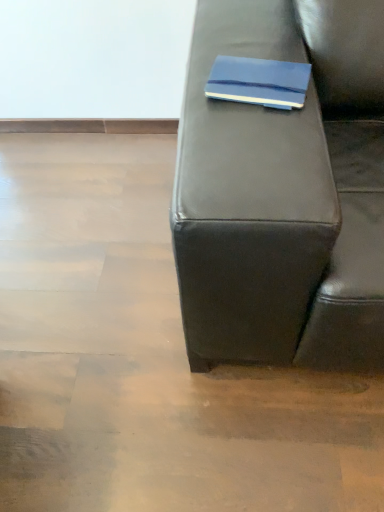
Question: Is blue matte notebook at upper center not near matte black couch at center?

Choices:
 (A) yes
 (B) no

Answer: (B)

Question: Considering the relative sizes of blue matte notebook at upper center and matte black couch at center in the image provided, is blue matte notebook at upper center bigger than matte black couch at center?

Choices:
 (A) no
 (B) yes

Answer: (A)

Question: Considering the relative positions of blue matte notebook at upper center and matte black couch at center in the image provided, is blue matte notebook at upper center behind matte black couch at center?

Choices:
 (A) yes
 (B) no

Answer: (A)

Question: Could you tell me if blue matte notebook at upper center is facing matte black couch at center?

Choices:
 (A) no
 (B) yes

Answer: (A)

Question: From the image's perspective, is blue matte notebook at upper center under matte black couch at center?

Choices:
 (A) yes
 (B) no

Answer: (B)

Question: Does blue matte notebook at upper center have a lesser width compared to matte black couch at center?

Choices:
 (A) yes
 (B) no

Answer: (A)

Question: Could you tell me if matte black couch at center is turned towards blue matte notebook at upper center?

Choices:
 (A) yes
 (B) no

Answer: (B)

Question: From the image's perspective, is matte black couch at center under blue matte notebook at upper center?

Choices:
 (A) yes
 (B) no

Answer: (A)

Question: Would you say blue matte notebook at upper center is part of matte black couch at center's contents?

Choices:
 (A) no
 (B) yes

Answer: (A)

Question: Can you confirm if matte black couch at center is shorter than blue matte notebook at upper center?

Choices:
 (A) no
 (B) yes

Answer: (A)

Question: Does matte black couch at center come behind blue matte notebook at upper center?

Choices:
 (A) yes
 (B) no

Answer: (B)

Question: Considering the relative sizes of matte black couch at center and blue matte notebook at upper center in the image provided, is matte black couch at center bigger than blue matte notebook at upper center?

Choices:
 (A) no
 (B) yes

Answer: (B)

Question: Is point (213, 65) closer or farther from the camera than point (331, 36)?

Choices:
 (A) closer
 (B) farther

Answer: (A)